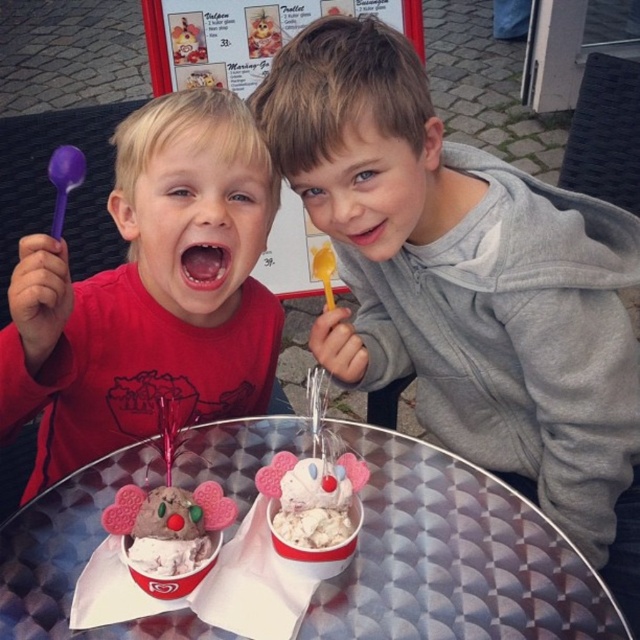
Is matte red shirt at left wider than metallic silver table at center?

No.

Is point (19, 321) positioned before point (122, 627)?

No, (19, 321) is behind (122, 627).

The height and width of the screenshot is (640, 640). I want to click on matte red shirt at left, so point(150,292).